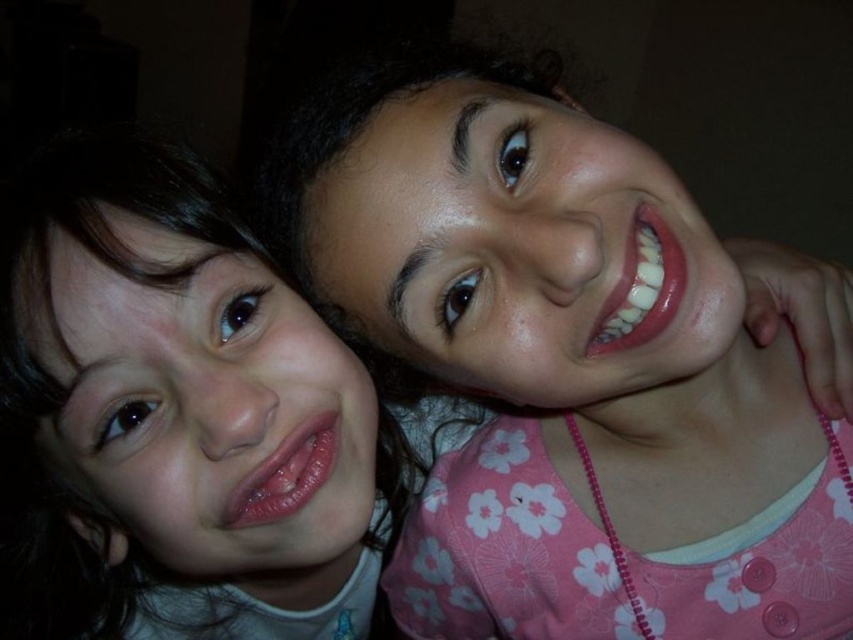
You are a photographer trying to adjust the lighting for a portrait. You notice the pink floral dress at upper right and the smooth skin face at upper left. Which object requires more light to ensure it is properly illuminated in the photo?

The smooth skin face at upper left requires more light because it is larger than the pink floral dress at upper right, and larger objects often need more even lighting to capture details effectively.

You are taking a photo of two people standing in front of you. You notice two specific points in the image labeled as point (x=459, y=566) and point (x=61, y=260). If you want to focus on the point that is closer to your camera, which point should you choose?

Point (x=61, y=260) is closer to the camera than point (x=459, y=566), so you should focus on point (x=61, y=260).